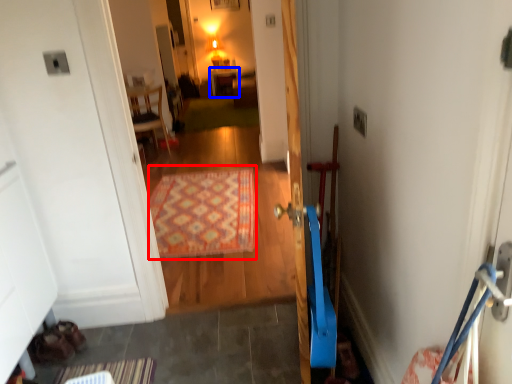
Question: Among these objects, which one is farthest to the camera, doormat (highlighted by a red box) or furniture (highlighted by a blue box)?

Choices:
 (A) doormat
 (B) furniture

Answer: (B)